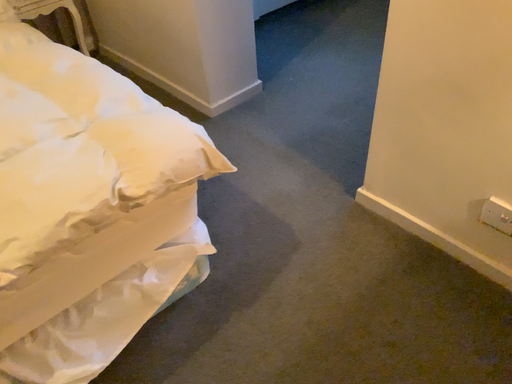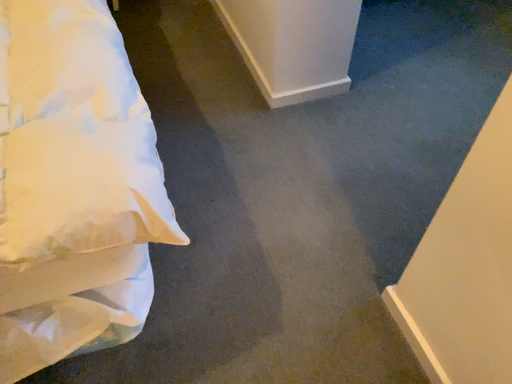
Question: How did the camera likely rotate when shooting the video?

Choices:
 (A) rotated right
 (B) rotated left

Answer: (B)